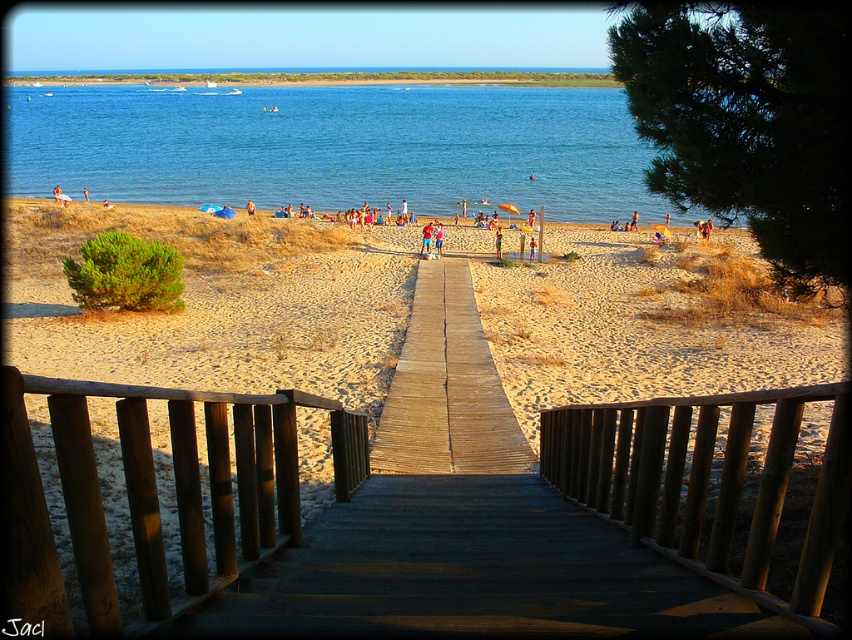
You are standing on the wooden staircase leading to the beach. You want to walk directly towards the blue water at center. Which direction should you walk relative to the brown wooden rail at center?

You should walk to the left of the brown wooden rail at center because the blue water at center is located to the left of it.

You are standing on the wooden staircase and looking down towards the beach. Which object do you see taking up more space in your view, the sandy beach at center or the brown wooden rail at center?

The sandy beach at center is larger in size than the brown wooden rail at center, so the sandy beach at center takes up more space in the view.

You are standing at the top of the wooden staircase looking down towards the beach. There are two points marked on the sand below you. The first point is at coordinates point (469,531) and the second point is at coordinates point (450,353). Which of these two points is closer to your current position?

Point (469,531) is closer to the viewer than point (450,353), so the first point is closer to your current position.